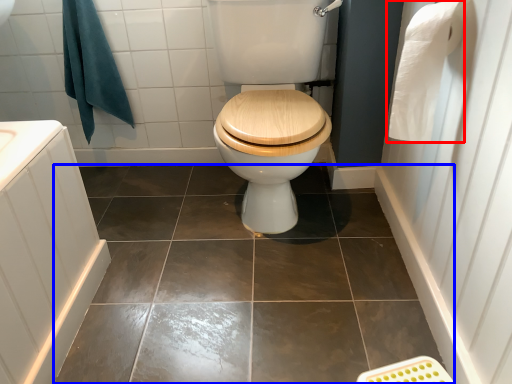
Question: Which object is further to the camera taking this photo, toilet paper (highlighted by a red box) or ceramic tile (highlighted by a blue box)?

Choices:
 (A) toilet paper
 (B) ceramic tile

Answer: (B)